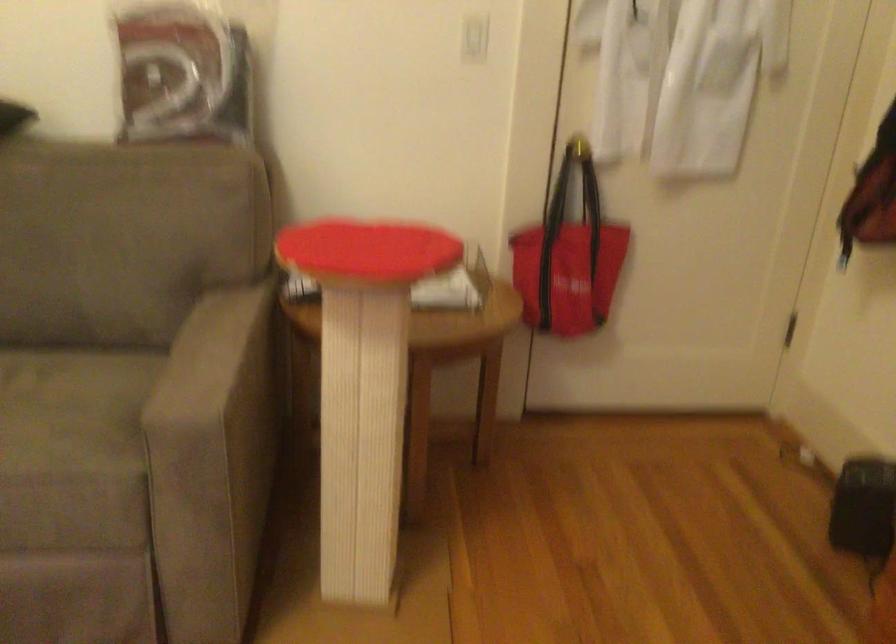
This screenshot has width=896, height=644. In order to click on sofa sitting surface in this screenshot , I will do `click(73, 410)`.